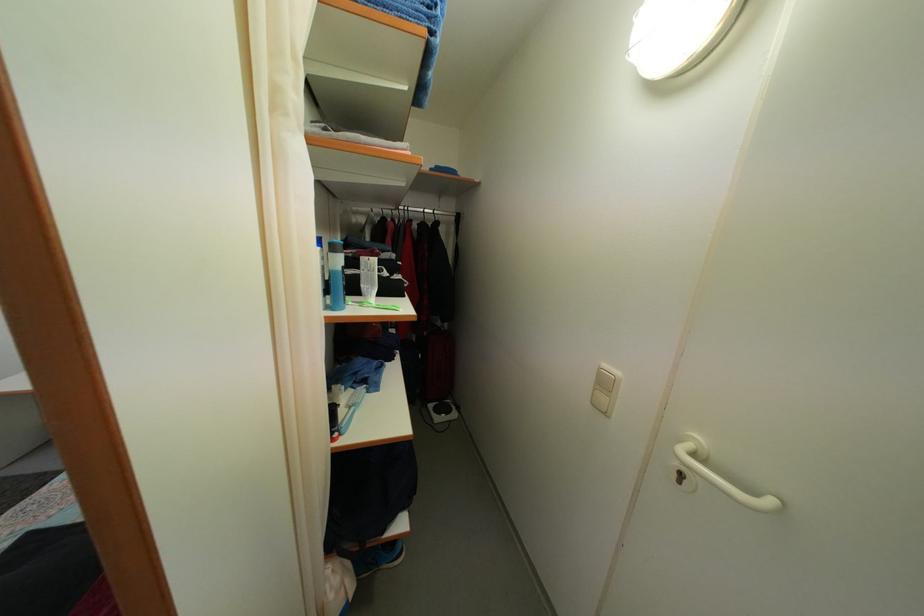
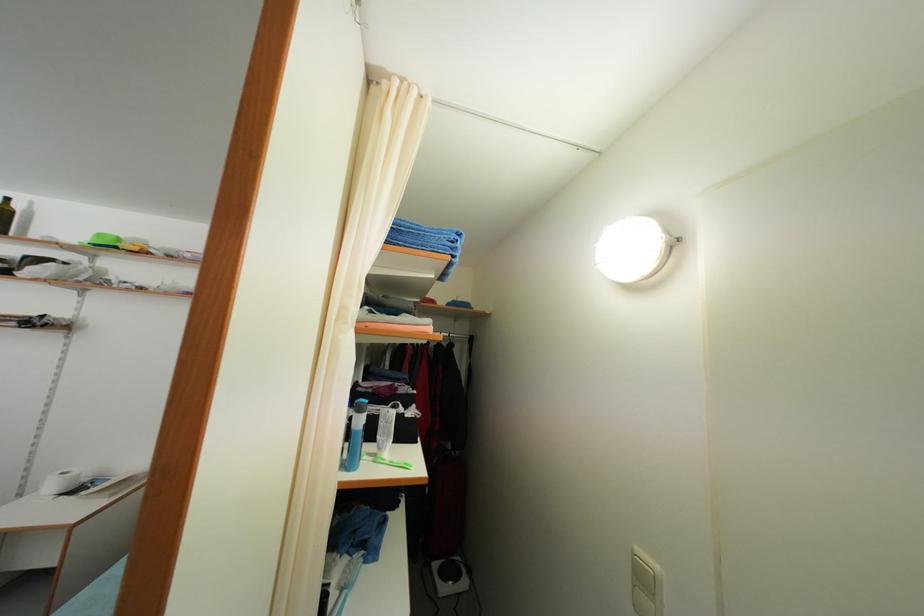
Find the pixel in the second image that matches the point at 601,397 in the first image.

(639, 593)